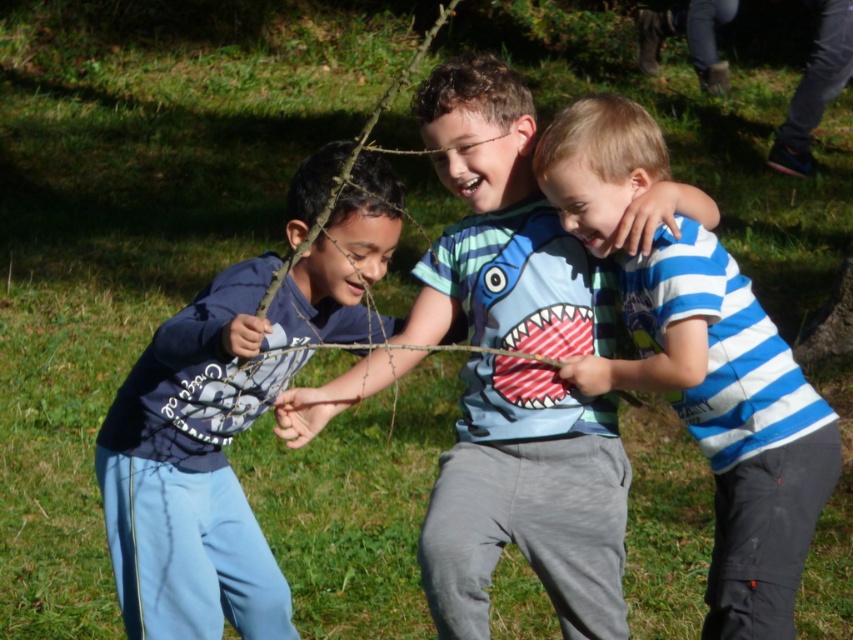
Who is taller, blue striped shirt at center or blue striped shirt at right?

blue striped shirt at center

Who is higher up, blue striped shirt at center or blue striped shirt at right?

blue striped shirt at right is above.

What do you see at coordinates (527, 500) in the screenshot? The image size is (853, 640). I see `blue striped shirt at center` at bounding box center [527, 500].

Image resolution: width=853 pixels, height=640 pixels. In order to click on blue striped shirt at center in this screenshot , I will do `click(527, 500)`.

Between point (527, 236) and point (299, 317), which one is positioned behind?

Point (527, 236)

In order to click on blue striped shirt at center in this screenshot , I will do `click(527, 500)`.

Locate an element on the screen. The image size is (853, 640). blue striped shirt at center is located at coordinates (527, 500).

Describe the element at coordinates (228, 422) in the screenshot. Image resolution: width=853 pixels, height=640 pixels. I see `blue cotton shirt at center` at that location.

Who is more distant from viewer, (x=294, y=227) or (x=625, y=374)?

Point (x=625, y=374)

The image size is (853, 640). In order to click on blue cotton shirt at center in this screenshot , I will do `click(228, 422)`.

Locate an element on the screen. blue cotton shirt at center is located at coordinates (x=228, y=422).